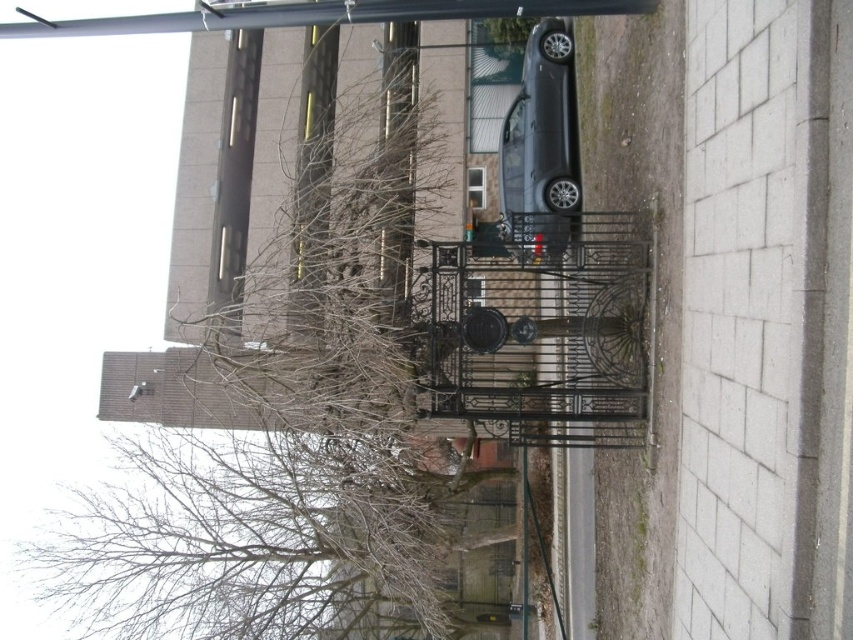
Question: Observing the image, what is the correct spatial positioning of black wrought iron gate at center in reference to satin black car at center?

Choices:
 (A) right
 (B) left

Answer: (B)

Question: Which point is farther to the camera?

Choices:
 (A) (624, 332)
 (B) (512, 186)

Answer: (B)

Question: Among these points, which one is nearest to the camera?

Choices:
 (A) (564, 84)
 (B) (547, 403)

Answer: (B)

Question: Can you confirm if black wrought iron gate at center is positioned to the left of satin black car at center?

Choices:
 (A) yes
 (B) no

Answer: (A)

Question: Considering the relative positions of black wrought iron gate at center and satin black car at center in the image provided, where is black wrought iron gate at center located with respect to satin black car at center?

Choices:
 (A) left
 (B) right

Answer: (A)

Question: Among these objects, which one is nearest to the camera?

Choices:
 (A) satin black car at center
 (B) black wrought iron gate at center

Answer: (B)